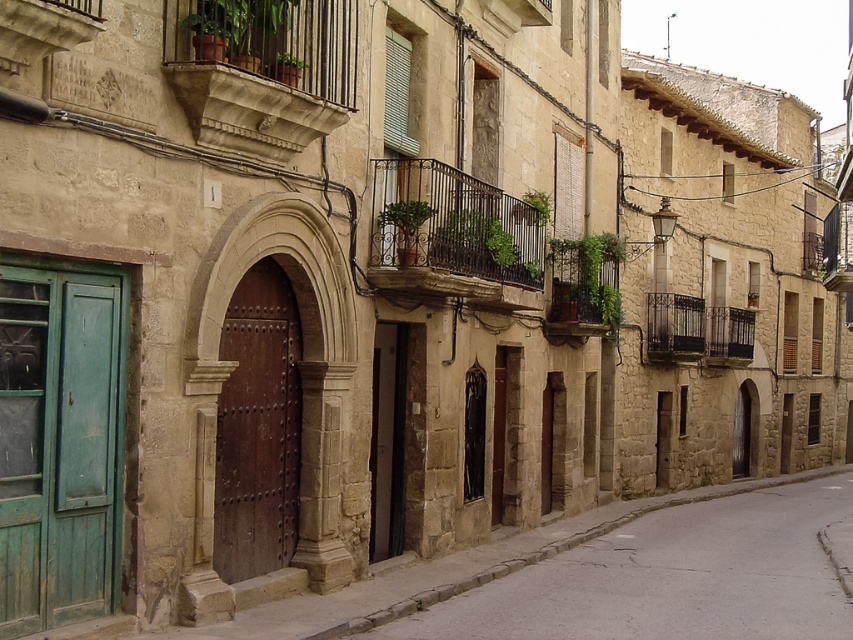
Question: Is green textured plants at center behind black wrought iron balcony at upper right?

Choices:
 (A) no
 (B) yes

Answer: (A)

Question: Estimate the real-world distances between objects in this image. Which object is closer to the smooth stone wall at center?

Choices:
 (A) green matte door at left
 (B) brown polished wood door at center

Answer: (B)

Question: Based on their relative distances, which object is nearer to the green textured plants at center?

Choices:
 (A) black wrought iron balcony at center
 (B) stone textured balcony at upper left
 (C) brown polished wood door at center

Answer: (A)

Question: Does stone textured balcony at upper left appear over green textured plants at center?

Choices:
 (A) yes
 (B) no

Answer: (A)

Question: Among these objects, which one is farthest from the camera?

Choices:
 (A) black wrought iron balcony at upper right
 (B) smooth stone wall at center

Answer: (A)

Question: Is smooth stone wall at center above black wrought iron balcony at center?

Choices:
 (A) no
 (B) yes

Answer: (A)